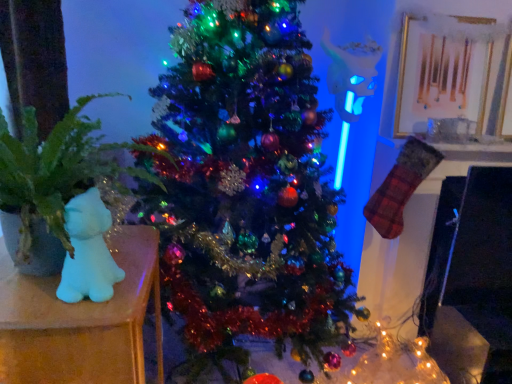
Where is `free point behind white matte plush cat at left`? The height and width of the screenshot is (384, 512). free point behind white matte plush cat at left is located at coordinates (129, 255).